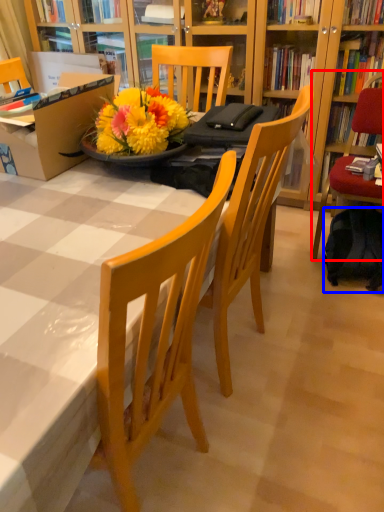
Question: Which object appears farthest to the camera in this image, chair (highlighted by a red box) or backpack (highlighted by a blue box)?

Choices:
 (A) chair
 (B) backpack

Answer: (B)